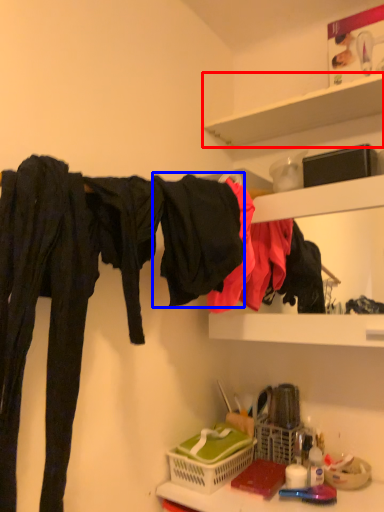
Question: Which point is closer to the camera, shelf (highlighted by a red box) or clothing (highlighted by a blue box)?

Choices:
 (A) shelf
 (B) clothing

Answer: (B)